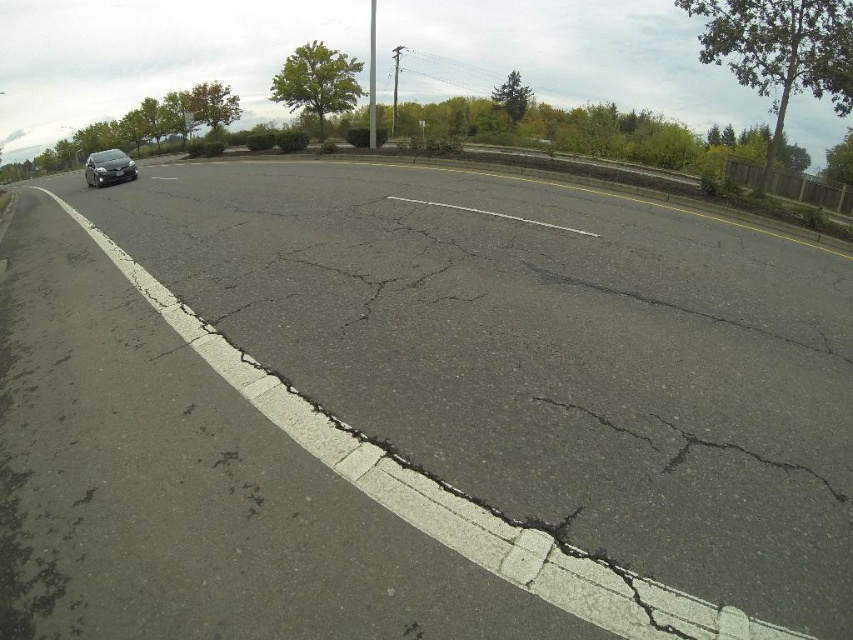
Question: Does black asphalt crack at center appear under satin black car at left?

Choices:
 (A) yes
 (B) no

Answer: (A)

Question: Is black asphalt crack at center smaller than satin black car at left?

Choices:
 (A) yes
 (B) no

Answer: (A)

Question: Is black asphalt crack at center bigger than satin black car at left?

Choices:
 (A) no
 (B) yes

Answer: (A)